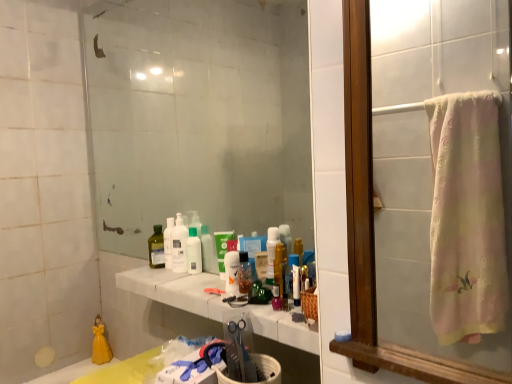
You are a GUI agent. You are given a task and a screenshot of the screen. Output one action in this format:
    pyautogui.click(x=<x>, y=<y>)
    Task: Click on the free space in front of white glossy bottle at center, which is counted as the second cleaning product, starting from the front
    Image resolution: width=512 pixels, height=384 pixels.
    Given the screenshot: What is the action you would take?
    pyautogui.click(x=187, y=279)